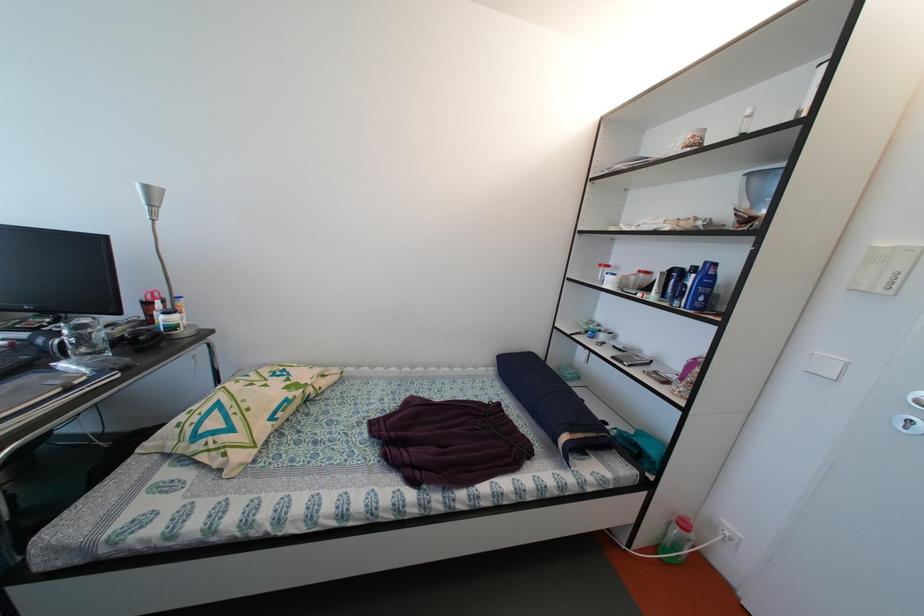
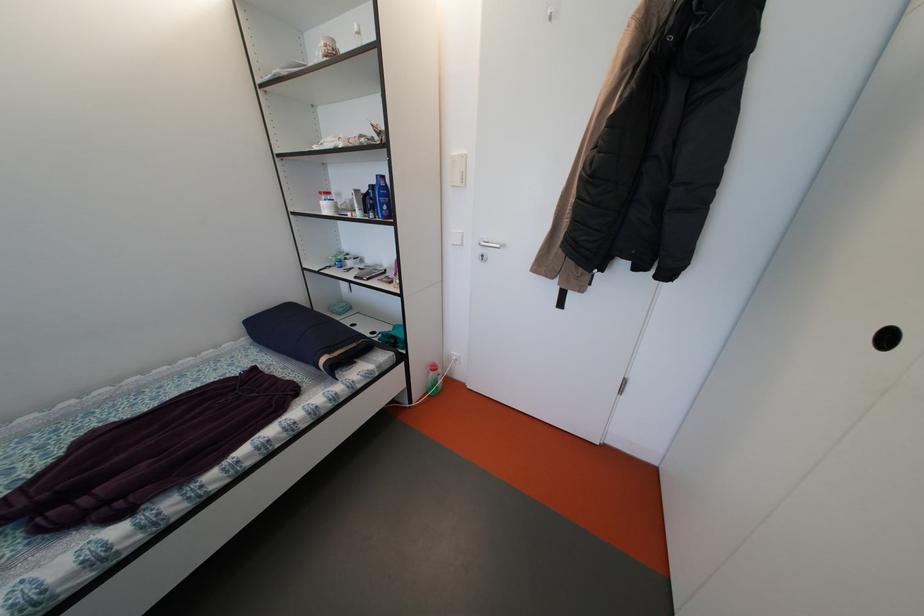
Where in the second image is the point corresponding to point (894, 245) from the first image?

(462, 156)